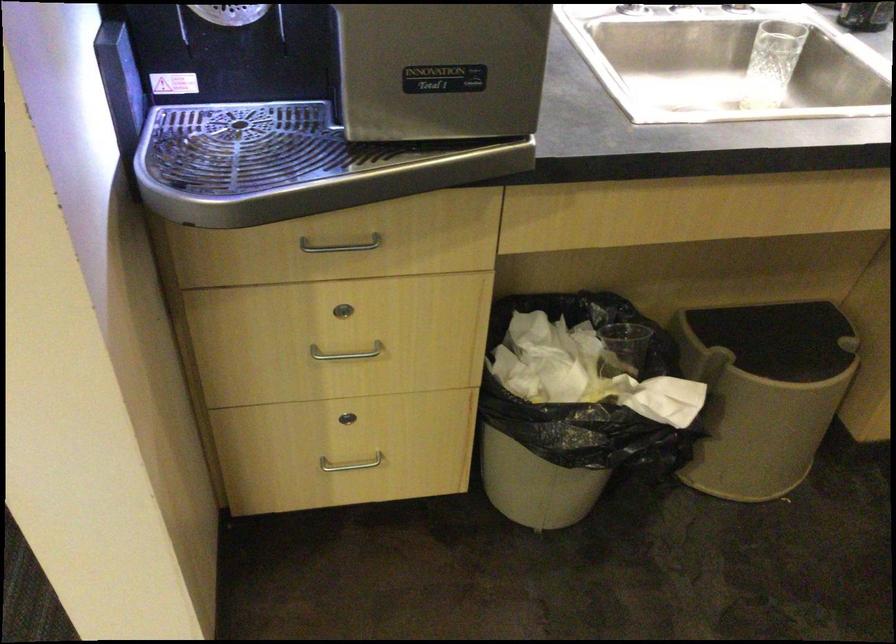
You are a GUI agent. You are given a task and a screenshot of the screen. Output one action in this format:
    pyautogui.click(x=<x>, y=<y>)
    Task: Click on the trash bin lid
    The width and height of the screenshot is (896, 644).
    Given the screenshot: What is the action you would take?
    pyautogui.click(x=780, y=339)